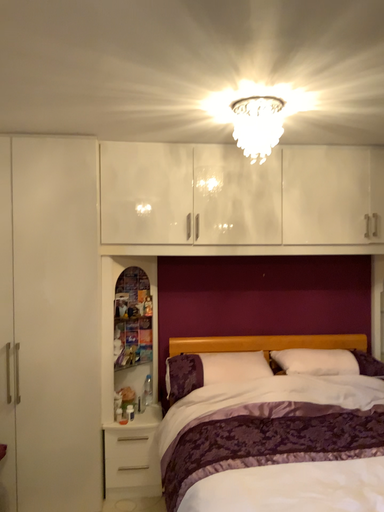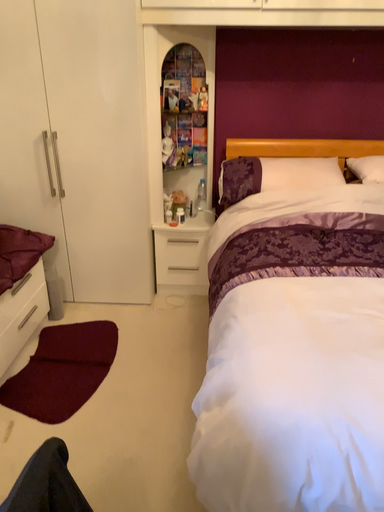
Question: Which way did the camera rotate in the video?

Choices:
 (A) rotated downward
 (B) rotated upward

Answer: (A)